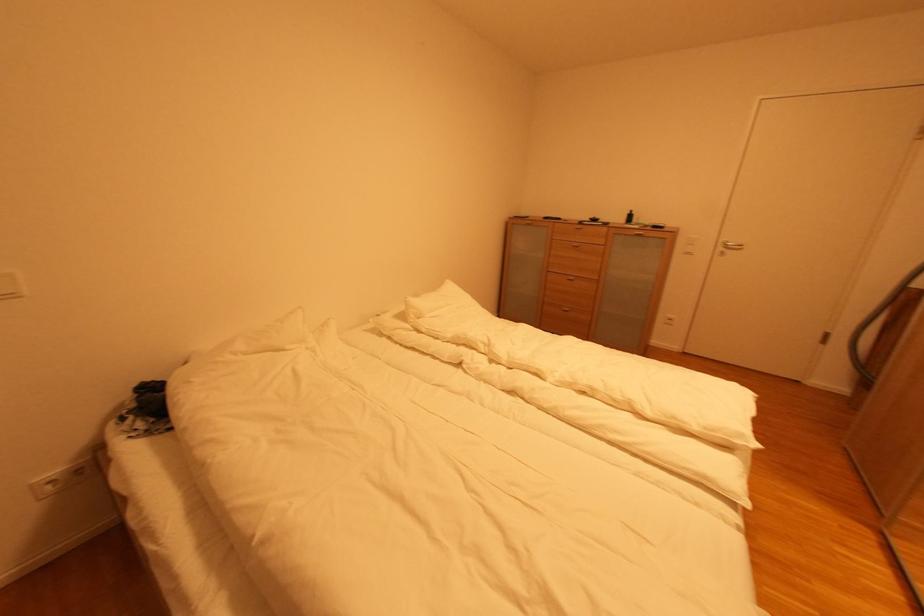
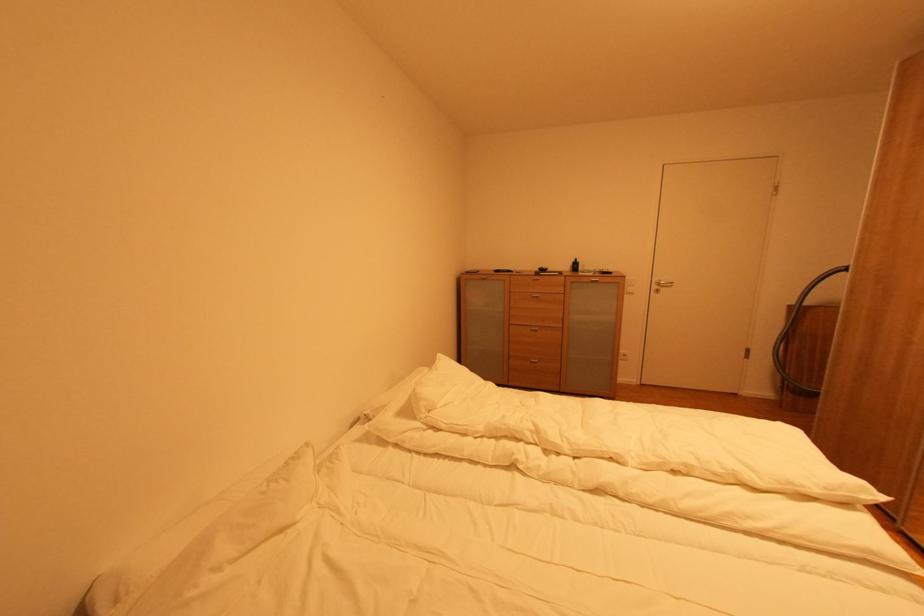
In the second image, find the point that corresponds to [581,246] in the first image.

(542, 298)